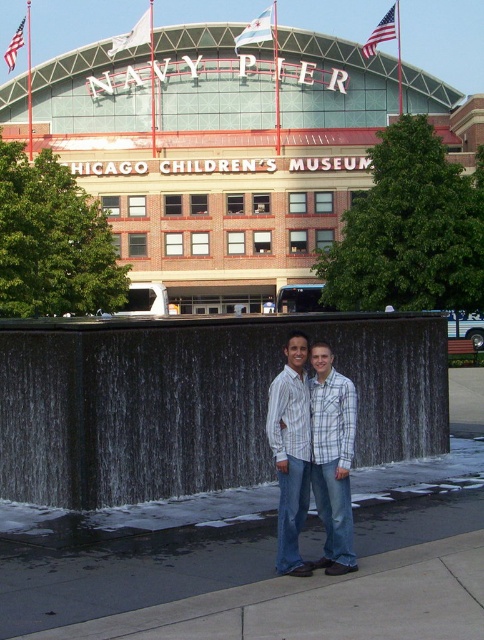
Can you confirm if black stone waterfall at center is wider than plaid shirt at center?

Correct, the width of black stone waterfall at center exceeds that of plaid shirt at center.

Does black stone waterfall at center have a smaller size compared to plaid shirt at center?

No.

Between point (138, 481) and point (290, 532), which one is positioned in front?

Point (290, 532) is in front.

At what (x,y) coordinates should I click in order to perform the action: click on black stone waterfall at center. Please return your answer as a coordinate pair (x, y). The image size is (484, 640). Looking at the image, I should click on (196, 401).

Is glass dome at center thinner than black stone waterfall at center?

In fact, glass dome at center might be wider than black stone waterfall at center.

The height and width of the screenshot is (640, 484). Describe the element at coordinates (217, 152) in the screenshot. I see `glass dome at center` at that location.

The width and height of the screenshot is (484, 640). In order to click on glass dome at center in this screenshot , I will do `click(217, 152)`.

Is black stone waterfall at center positioned behind smooth concrete sidewalk at center?

Yes, it is behind smooth concrete sidewalk at center.

Based on the photo, can you confirm if black stone waterfall at center is positioned to the left of smooth concrete sidewalk at center?

Yes, black stone waterfall at center is to the left of smooth concrete sidewalk at center.

Locate an element on the screen. black stone waterfall at center is located at coordinates (196, 401).